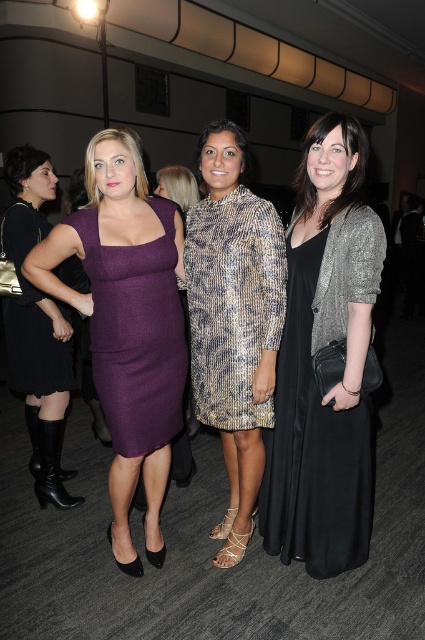
Can you confirm if black leather boots at lower left is positioned to the right of black matte dress at left?

Indeed, black leather boots at lower left is positioned on the right side of black matte dress at left.

What do you see at coordinates (36, 326) in the screenshot? I see `black leather boots at lower left` at bounding box center [36, 326].

Where is `black leather boots at lower left`? black leather boots at lower left is located at coordinates (36, 326).

Is gold sequined dress at center shorter than purple wool dress at center?

In fact, gold sequined dress at center may be taller than purple wool dress at center.

Who is more forward, (x=238, y=145) or (x=78, y=291)?

Point (x=238, y=145) is more forward.

Where is `gold sequined dress at center`? gold sequined dress at center is located at coordinates (234, 321).

Is the position of black satin dress at center more distant than that of black matte dress at left?

No, black satin dress at center is closer to the viewer.

Which is in front, point (308, 572) or point (36, 230)?

Point (308, 572) is in front.

The height and width of the screenshot is (640, 425). I want to click on black satin dress at center, so click(326, 349).